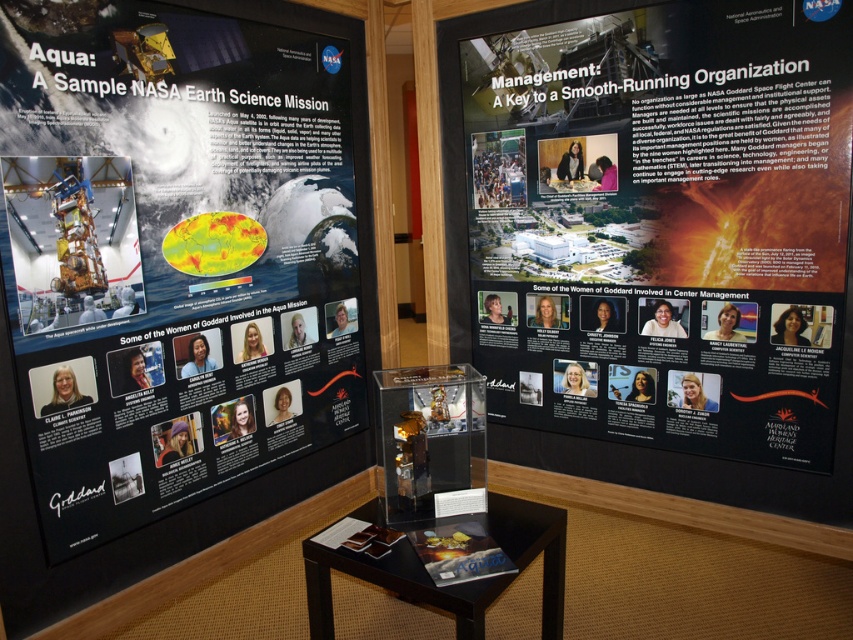
Does matte black poster at left have a smaller size compared to matte black poster at center?

Yes.

Does matte black poster at left have a greater height compared to matte black poster at center?

Correct, matte black poster at left is much taller as matte black poster at center.

Describe the element at coordinates (173, 252) in the screenshot. The image size is (853, 640). I see `matte black poster at left` at that location.

Where is `matte black poster at left`? matte black poster at left is located at coordinates (173, 252).